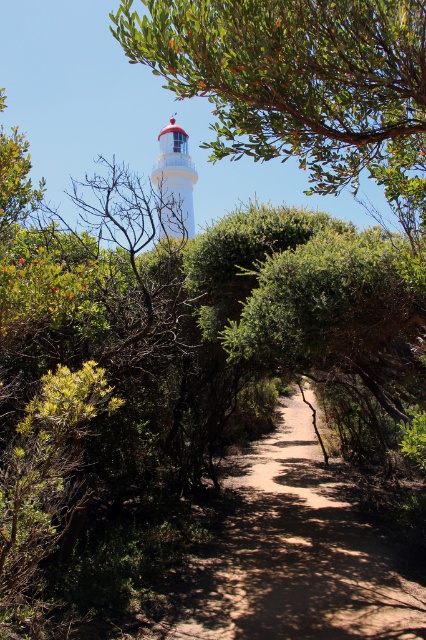
Does dirt path at center have a lesser width compared to white matte lighthouse at upper center?

In fact, dirt path at center might be wider than white matte lighthouse at upper center.

Does dirt path at center appear on the left side of white matte lighthouse at upper center?

Incorrect, dirt path at center is not on the left side of white matte lighthouse at upper center.

Where is `dirt path at center`? Image resolution: width=426 pixels, height=640 pixels. dirt path at center is located at coordinates (287, 554).

Is green leafy tree at upper center to the right of dirt path at center from the viewer's perspective?

In fact, green leafy tree at upper center is to the left of dirt path at center.

Consider the image. Does green leafy tree at upper center have a greater width compared to dirt path at center?

In fact, green leafy tree at upper center might be narrower than dirt path at center.

Is point (149, 20) behind point (270, 456)?

No, (149, 20) is in front of (270, 456).

Identify the location of green leafy tree at upper center. The height and width of the screenshot is (640, 426). (299, 83).

Between green leafy tree at upper center and white matte lighthouse at upper center, which one appears on the left side from the viewer's perspective?

Positioned to the left is white matte lighthouse at upper center.

Does point (275, 29) come farther from viewer compared to point (192, 172)?

No, (275, 29) is in front of (192, 172).

This screenshot has width=426, height=640. Identify the location of green leafy tree at upper center. (299, 83).